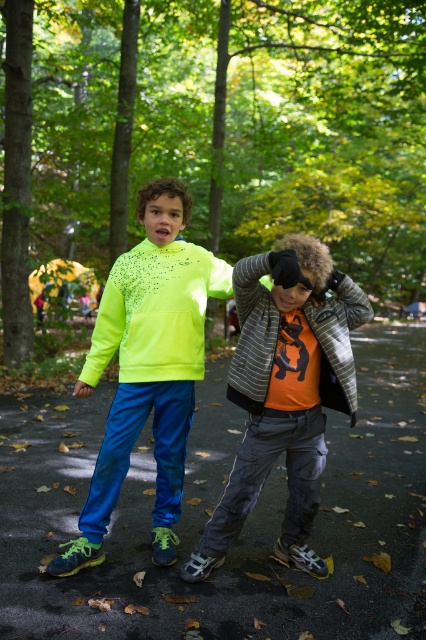
Question: Which object appears closest to the camera in this image?

Choices:
 (A) orange matte shirt at center
 (B) striped wool jacket at center
 (C) neon yellow hoodie at center
 (D) neon matte sweatshirt at left

Answer: (A)

Question: Estimate the real-world distances between objects in this image. Which object is closer to the striped wool jacket at center?

Choices:
 (A) neon yellow hoodie at center
 (B) neon matte sweatshirt at left
 (C) orange matte shirt at center

Answer: (C)

Question: Which object is farther from the camera taking this photo?

Choices:
 (A) striped wool jacket at center
 (B) neon yellow hoodie at center

Answer: (B)

Question: Is orange matte shirt at center positioned at the back of neon yellow hoodie at center?

Choices:
 (A) yes
 (B) no

Answer: (B)

Question: Does orange matte shirt at center come behind neon yellow hoodie at center?

Choices:
 (A) no
 (B) yes

Answer: (A)

Question: Can you confirm if orange matte shirt at center is bigger than neon matte sweatshirt at left?

Choices:
 (A) no
 (B) yes

Answer: (B)